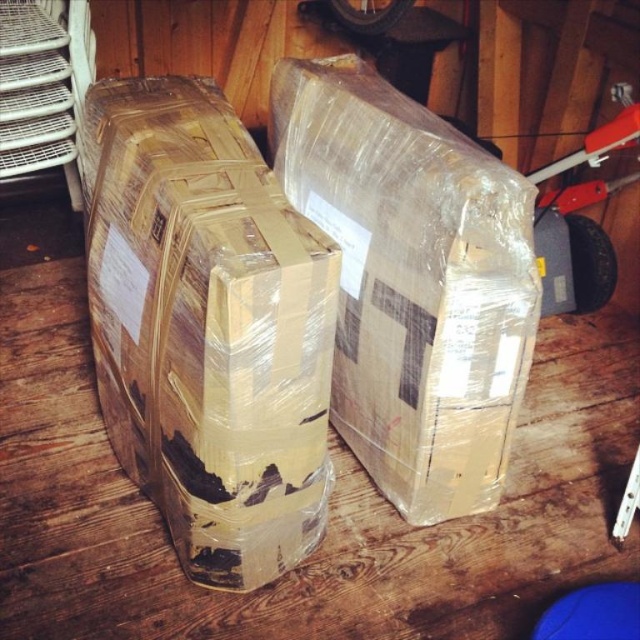
Question: Can you confirm if brown cardboard box at center is smaller than clear plastic box at center?

Choices:
 (A) no
 (B) yes

Answer: (A)

Question: Which point is closer to the camera?

Choices:
 (A) brown cardboard box at center
 (B) clear plastic box at center

Answer: (A)

Question: Does brown cardboard box at center appear over clear plastic box at center?

Choices:
 (A) no
 (B) yes

Answer: (A)

Question: Does brown cardboard box at center appear on the right side of clear plastic box at center?

Choices:
 (A) yes
 (B) no

Answer: (B)

Question: Which point is closer to the camera taking this photo?

Choices:
 (A) (118, 426)
 (B) (493, 177)

Answer: (B)